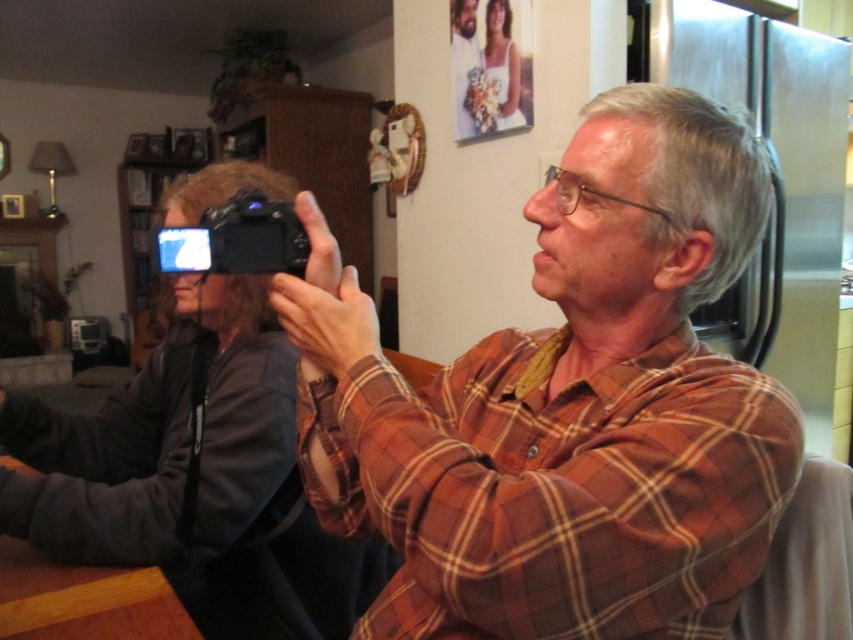
Question: Which point appears farthest from the camera in this image?

Choices:
 (A) (172, 250)
 (B) (509, 339)
 (C) (497, 26)

Answer: (C)

Question: Which object is the closest to the black plastic camera at center?

Choices:
 (A) brown plaid shirt at center
 (B) satin white dress at upper center

Answer: (A)

Question: Is the position of black plastic camera at center less distant than that of satin white dress at upper center?

Choices:
 (A) yes
 (B) no

Answer: (A)

Question: Can you confirm if brown plaid shirt at center is positioned to the right of satin white dress at upper center?

Choices:
 (A) no
 (B) yes

Answer: (A)

Question: From the image, what is the correct spatial relationship of black plastic camera at center in relation to satin white dress at upper center?

Choices:
 (A) right
 (B) left

Answer: (B)

Question: Considering the real-world distances, which object is closest to the satin white dress at upper center?

Choices:
 (A) black plastic camera at center
 (B) brown plaid shirt at center

Answer: (A)